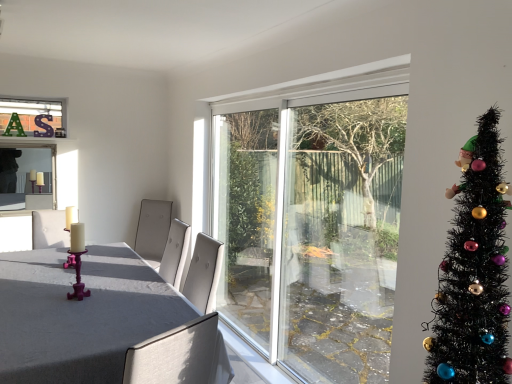
The height and width of the screenshot is (384, 512). What are the coordinates of `purple metallic candle holder at left` in the screenshot? It's located at (75, 252).

Image resolution: width=512 pixels, height=384 pixels. I want to click on matte glass candlesticks at left, so point(27,178).

What are the coordinates of `matte gray table at center` in the screenshot? It's located at (92, 319).

The image size is (512, 384). Identify the location of purple metallic candle holder at left. [x=75, y=252].

From their relative heights in the image, would you say black artificial christmas tree at right is taller or shorter than matte glass candlesticks at left?

Clearly, black artificial christmas tree at right is taller compared to matte glass candlesticks at left.

Is matte glass candlesticks at left a part of black artificial christmas tree at right?

No, matte glass candlesticks at left is located outside of black artificial christmas tree at right.

Who is more distant, black artificial christmas tree at right or matte glass candlesticks at left?

matte glass candlesticks at left is further from the camera.

Between purple metallic candle holder at left and matte glass candlesticks at left, which one appears on the left side from the viewer's perspective?

From the viewer's perspective, matte glass candlesticks at left appears more on the left side.

From a real-world perspective, is purple metallic candle holder at left beneath matte glass candlesticks at left?

Yes, from a real-world perspective, purple metallic candle holder at left is under matte glass candlesticks at left.

Is purple metallic candle holder at left positioned beyond the bounds of matte glass candlesticks at left?

Yes, purple metallic candle holder at left is not within matte glass candlesticks at left.

Is the surface of purple metallic candle holder at left in direct contact with matte glass candlesticks at left?

No, purple metallic candle holder at left is not next to matte glass candlesticks at left.

Could you tell me if white glossy candle at left is facing black artificial christmas tree at right?

No, white glossy candle at left does not turn towards black artificial christmas tree at right.

Which of these two, white glossy candle at left or black artificial christmas tree at right, is wider?

black artificial christmas tree at right.

Is white glossy candle at left at the right side of black artificial christmas tree at right?

No.

Identify the location of candle to the left of black artificial christmas tree at right. (75, 230).

Considering the relative sizes of purple metallic candle holder at left and white glossy candle at left in the image provided, is purple metallic candle holder at left bigger than white glossy candle at left?

Yes, purple metallic candle holder at left is bigger than white glossy candle at left.

Looking at their sizes, would you say purple metallic candle holder at left is wider or thinner than white glossy candle at left?

Clearly, purple metallic candle holder at left has more width compared to white glossy candle at left.

Is purple metallic candle holder at left directly adjacent to white glossy candle at left?

Yes, purple metallic candle holder at left is right next to white glossy candle at left and making contact.

Is matte gray table at center placed right next to white glossy candle at left?

No, matte gray table at center is not touching white glossy candle at left.

Is matte gray table at center shorter than white glossy candle at left?

In fact, matte gray table at center may be taller than white glossy candle at left.

Can we say matte gray table at center lies outside white glossy candle at left?

That's correct, matte gray table at center is outside of white glossy candle at left.

Is point (2, 277) behind point (77, 255)?

That is True.

Are matte gray table at center and purple metallic candle holder at left beside each other?

No, matte gray table at center is not touching purple metallic candle holder at left.

How different are the orientations of matte gray table at center and purple metallic candle holder at left in degrees?

There is a 1.28-degree angle between the facing directions of matte gray table at center and purple metallic candle holder at left.

Is matte gray table at center outside of purple metallic candle holder at left?

matte gray table at center is positioned outside purple metallic candle holder at left.

From the picture: Considering the relative sizes of matte glass candlesticks at left and matte gray table at center in the image provided, is matte glass candlesticks at left shorter than matte gray table at center?

Yes, matte glass candlesticks at left is shorter than matte gray table at center.

From the image's perspective, relative to matte gray table at center, is matte glass candlesticks at left above or below?

matte glass candlesticks at left is above matte gray table at center.

Considering the sizes of objects matte glass candlesticks at left and matte gray table at center in the image provided, who is bigger, matte glass candlesticks at left or matte gray table at center?

matte gray table at center is bigger.

You are a GUI agent. You are given a task and a screenshot of the screen. Output one action in this format:
    pyautogui.click(x=<x>, y=<y>)
    Task: Click on the christmas tree on the right side of matte glass candlesticks at left
    
    Given the screenshot: What is the action you would take?
    pyautogui.click(x=473, y=272)

This screenshot has width=512, height=384. Find the location of `window screen above the purple metallic candle holder at left (from the image's perspective)`. window screen above the purple metallic candle holder at left (from the image's perspective) is located at coordinates (27, 178).

Estimate the real-world distances between objects in this image. Which object is further from black artificial christmas tree at right, matte gray table at center or white glossy candle at left?

white glossy candle at left is positioned further to the anchor black artificial christmas tree at right.

When comparing their distances from matte glass candlesticks at left, does black artificial christmas tree at right or matte gray table at center seem closer?

Based on the image, matte gray table at center appears to be nearer to matte glass candlesticks at left.

Estimate the real-world distances between objects in this image. Which object is closer to purple metallic candle holder at left, white glossy candle at left or black artificial christmas tree at right?

white glossy candle at left is positioned closer to the anchor purple metallic candle holder at left.

Estimate the real-world distances between objects in this image. Which object is further from white glossy candle at left, purple metallic candle holder at left or matte glass candlesticks at left?

matte glass candlesticks at left.

Based on their spatial positions, is matte glass candlesticks at left or white glossy candle at left further from black artificial christmas tree at right?

matte glass candlesticks at left.

Estimate the real-world distances between objects in this image. Which object is closer to white glossy candle at left, purple metallic candle holder at left or black artificial christmas tree at right?

Based on the image, purple metallic candle holder at left appears to be nearer to white glossy candle at left.

Based on their spatial positions, is white glossy candle at left or matte glass candlesticks at left closer to purple metallic candle holder at left?

white glossy candle at left is closer to purple metallic candle holder at left.

Which object lies further to the anchor point matte gray table at center, purple metallic candle holder at left or white glossy candle at left?

Among the two, white glossy candle at left is located further to matte gray table at center.

The image size is (512, 384). In order to click on candle between black artificial christmas tree at right and matte glass candlesticks at left along the z-axis in this screenshot , I will do `click(75, 230)`.

The height and width of the screenshot is (384, 512). I want to click on table between black artificial christmas tree at right and matte glass candlesticks at left in the front-back direction, so click(92, 319).

Locate an element on the screen. candle holder situated between white glossy candle at left and black artificial christmas tree at right from left to right is located at coordinates (75, 252).

You are a GUI agent. You are given a task and a screenshot of the screen. Output one action in this format:
    pyautogui.click(x=<x>, y=<y>)
    Task: Click on the candle holder between black artificial christmas tree at right and matte glass candlesticks at left along the z-axis
    The image size is (512, 384).
    Given the screenshot: What is the action you would take?
    click(x=75, y=252)